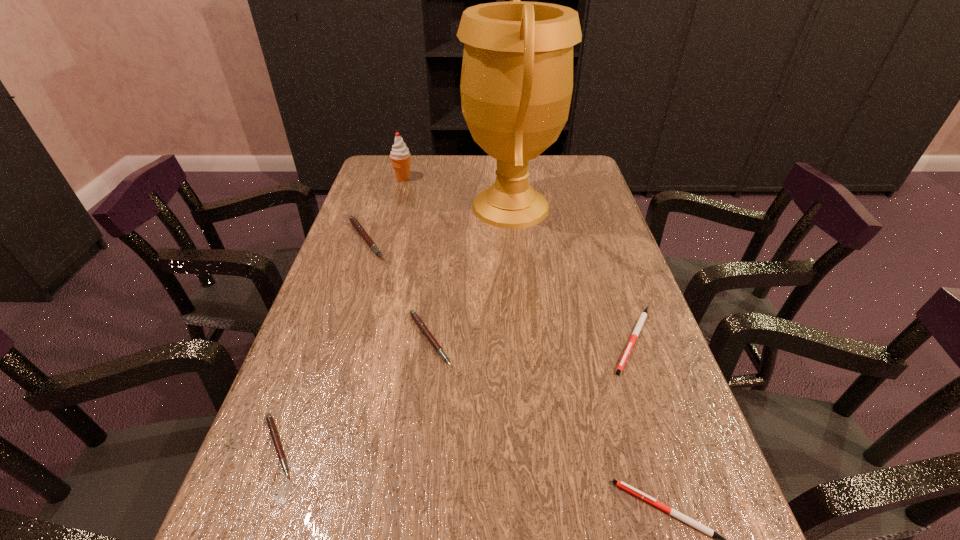
Identify the location of icecream positioned at the left edge. This screenshot has width=960, height=540. (400, 156).

Identify the location of trophy that is at the right edge. This screenshot has height=540, width=960. (516, 86).

The width and height of the screenshot is (960, 540). What are the coordinates of `pen that is at the right edge` in the screenshot? It's located at (637, 329).

Where is `object located at the far left corner`? object located at the far left corner is located at coordinates (400, 156).

This screenshot has width=960, height=540. Identify the location of object that is at the far right corner. (516, 86).

Where is `vacant space at the far edge of the desktop`? The image size is (960, 540). vacant space at the far edge of the desktop is located at coordinates (529, 167).

The image size is (960, 540). In order to click on vacant region at the left edge in this screenshot , I will do `click(294, 395)`.

I want to click on free space at the right edge of the desktop, so click(630, 280).

In order to click on vacant region at the far left corner in this screenshot , I will do `click(392, 168)`.

Image resolution: width=960 pixels, height=540 pixels. In the image, there is a desktop. Identify the location of vacant region at the far right corner. (569, 185).